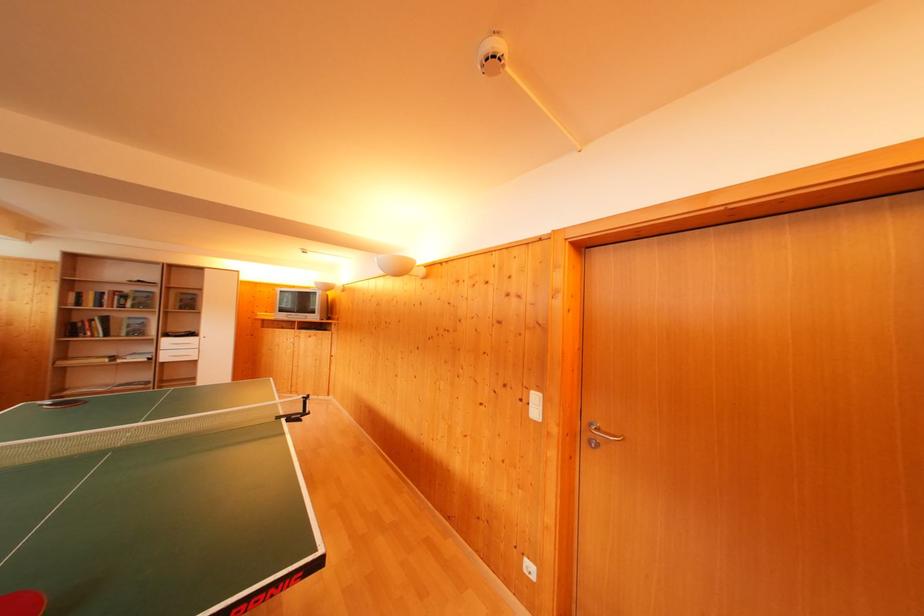
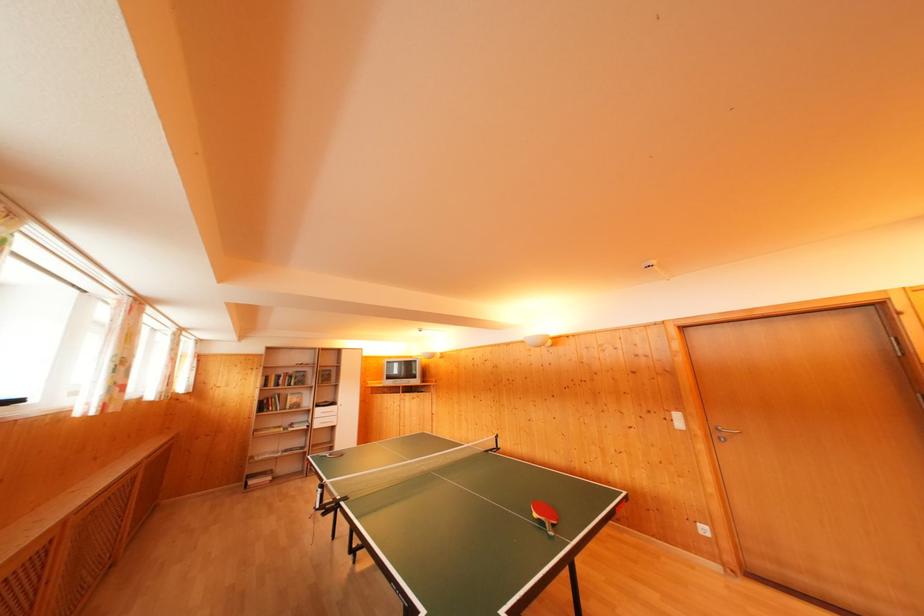
Find the pixel in the second image that matches (131,294) in the first image.

(296, 376)